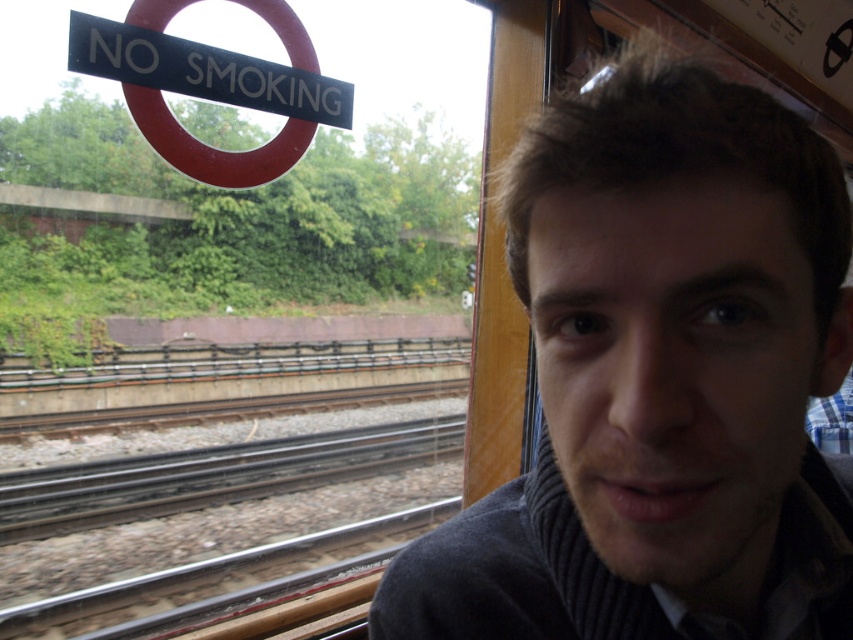
You are a photographer trying to capture a closeup of the gray ribbed sweater at right. Your camera has a minimum focusing distance of 12 inches. Can you take the photo without moving the camera or the sweater?

The gray ribbed sweater at right and camera are 11.53 inches apart from each other, which is less than the camera minimum focusing distance of 12 inches. Therefore, you cannot take the photo without moving the camera or the sweater.

You are a passenger in the train carriage and want to know which object is shorter between the gray ribbed sweater at right and the black plastic sign at upper left. Can you determine this?

The gray ribbed sweater at right is not as tall as the black plastic sign at upper left, so the gray ribbed sweater at right is shorter.